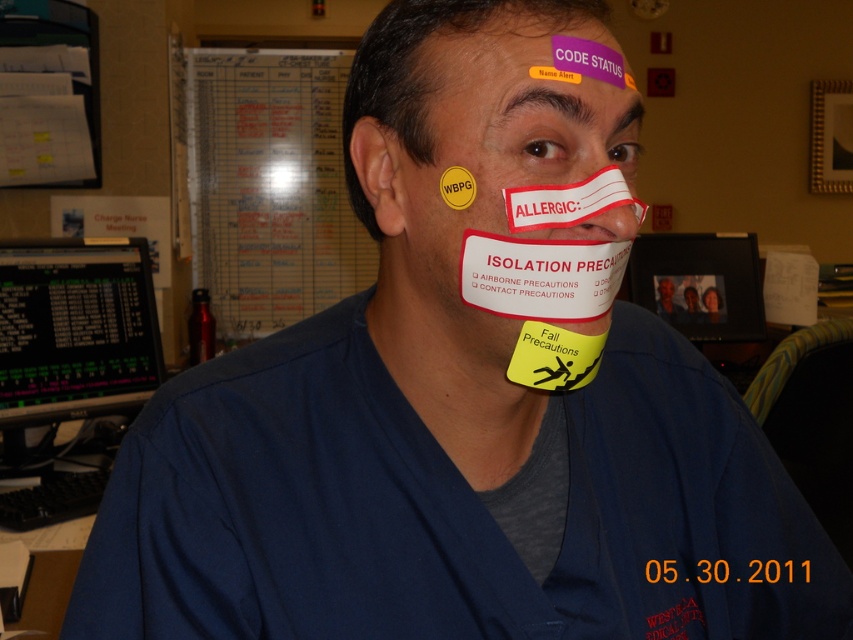
You are a nurse in a hospital who needs to check the patient information on the green lcd monitor at left while also noting the yellow matte sticker at upper center. Can you do both without moving your head more than 5 feet?

The green lcd monitor at left and yellow matte sticker at upper center are 4.38 feet apart, so yes, you can check both without moving your head more than 5 feet since 4.38 feet is less than 5 feet.

You are a nurse in a hospital and need to check the patient information on the green lcd monitor at left while observing the matte white nose at center. Which object is located to the left of the other?

The green lcd monitor at left is positioned on the left side of matte white nose at center, so the green lcd monitor at left is to the left of the matte white nose at center.

You are a healthcare worker who needs to update the information on the green lcd monitor at left while standing at the matte white nose at center. Can you reach the monitor without moving your position?

The green lcd monitor at left is 1.33 meters from matte white nose at center. Since the average arm length is about 0.7 meters, you cannot reach the monitor without moving your position.